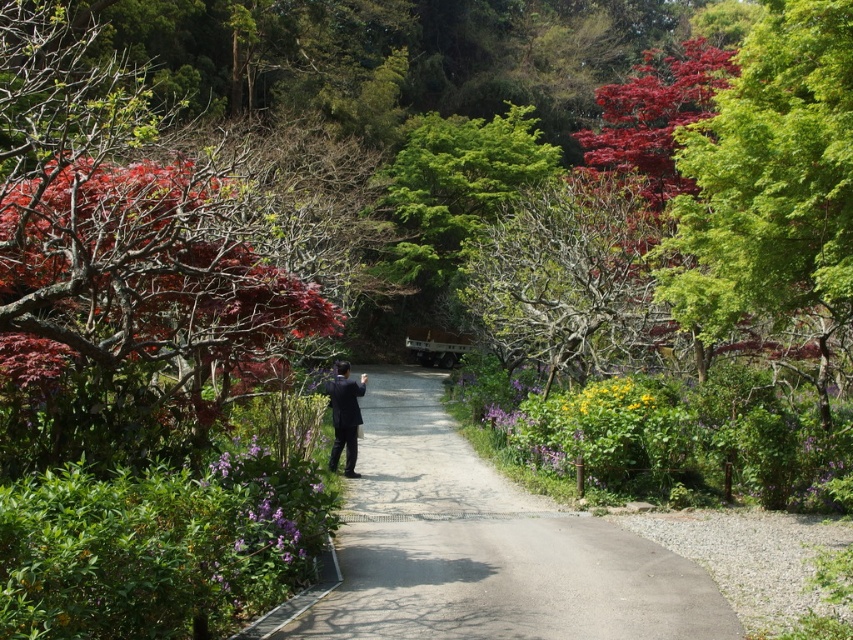
Question: Does purple matte flower at lower left appear on the right side of yellow matte flower at center?

Choices:
 (A) no
 (B) yes

Answer: (A)

Question: Is gray concrete path at center thinner than purple matte flower at lower left?

Choices:
 (A) yes
 (B) no

Answer: (B)

Question: Among these objects, which one is farthest from the camera?

Choices:
 (A) black suit at center
 (B) gray concrete path at center
 (C) yellow matte flower at center
 (D) purple matte flower at lower left

Answer: (A)

Question: Is gray concrete path at center to the right of black suit at center from the viewer's perspective?

Choices:
 (A) no
 (B) yes

Answer: (B)

Question: Which point is closer to the camera?

Choices:
 (A) (338, 380)
 (B) (515, 584)
 (C) (651, 380)

Answer: (B)

Question: Estimate the real-world distances between objects in this image. Which object is farther from the yellow matte flower at center?

Choices:
 (A) purple matte flower at lower left
 (B) black suit at center

Answer: (A)